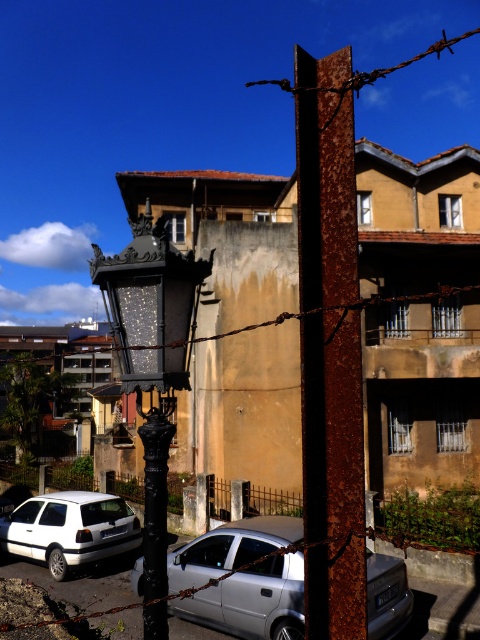
Question: Among these points, which one is farthest from the camera?

Choices:
 (A) (139, 520)
 (B) (360, 561)
 (C) (439, 496)
 (D) (162, 269)

Answer: (C)

Question: Can you confirm if rusty metal fence at lower center is smaller than white matte hatchback at lower left?

Choices:
 (A) no
 (B) yes

Answer: (A)

Question: Is rusty metal pole at center above white matte hatchback at lower left?

Choices:
 (A) no
 (B) yes

Answer: (B)

Question: Which point is closer to the camera taking this photo?

Choices:
 (A) (372, 566)
 (B) (17, 525)
 (C) (142, 484)
 (D) (155, 429)

Answer: (D)

Question: Which object is positioned closest to the black wrought iron streetlamp at center-left?

Choices:
 (A) silver metallic car at center
 (B) white matte hatchback at lower left

Answer: (A)

Question: Observing the image, what is the correct spatial positioning of rusty metal pole at center in reference to rusty metal fence at lower center?

Choices:
 (A) above
 (B) below

Answer: (A)